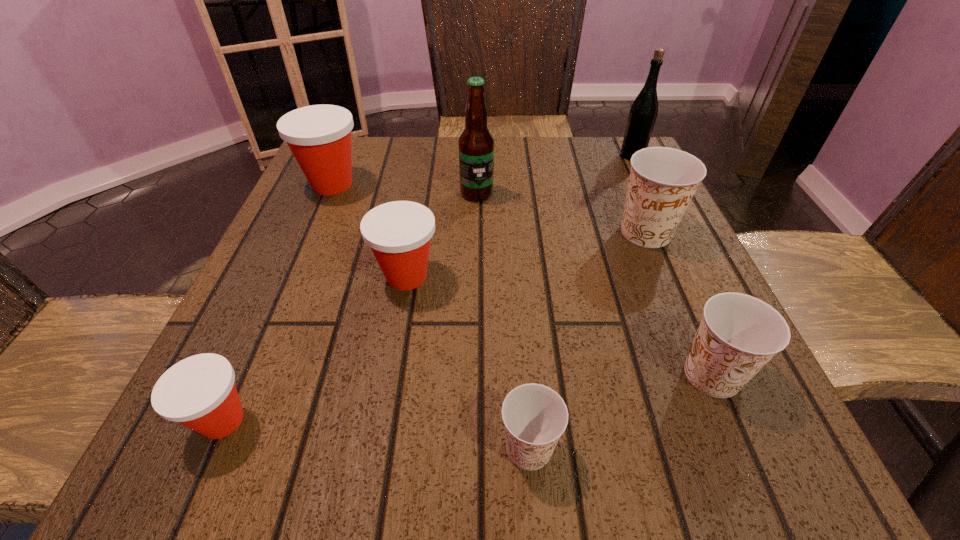
The height and width of the screenshot is (540, 960). In the image, there is a desktop. In order to click on free space at the far right corner in this screenshot , I will do `click(587, 157)`.

Where is `empty space that is in between the nearest red-orange Dixie cup and the green beer bottle`? The image size is (960, 540). empty space that is in between the nearest red-orange Dixie cup and the green beer bottle is located at coordinates (427, 288).

The width and height of the screenshot is (960, 540). I want to click on free space between the sixth object from right to left and the leftmost orange Dixie cup, so click(x=468, y=362).

Identify the location of free spot between the second farthest orange Dixie cup and the sixth object from right to left. (559, 326).

Image resolution: width=960 pixels, height=540 pixels. In order to click on empty space that is in between the smallest red-orange Dixie cup and the biggest red-orange Dixie cup in this screenshot , I will do tap(277, 302).

The image size is (960, 540). Find the location of `unoccupied area between the smallest orange Dixie cup and the brown beer bottle`. unoccupied area between the smallest orange Dixie cup and the brown beer bottle is located at coordinates (503, 321).

The image size is (960, 540). What are the coordinates of `vacant area between the nearest orange Dixie cup and the third farthest Dixie cup` in the screenshot? It's located at pyautogui.click(x=468, y=362).

This screenshot has width=960, height=540. I want to click on empty location between the farthest red-orange Dixie cup and the leftmost orange Dixie cup, so click(x=430, y=316).

Locate an element on the screen. The height and width of the screenshot is (540, 960). free point between the smallest orange Dixie cup and the second biggest orange Dixie cup is located at coordinates (620, 411).

You are a GUI agent. You are given a task and a screenshot of the screen. Output one action in this format:
    pyautogui.click(x=<x>, y=<y>)
    Task: Click on the blank region between the second biggest orange Dixie cup and the right beer bottle
    The image size is (960, 540).
    Given the screenshot: What is the action you would take?
    pyautogui.click(x=672, y=265)